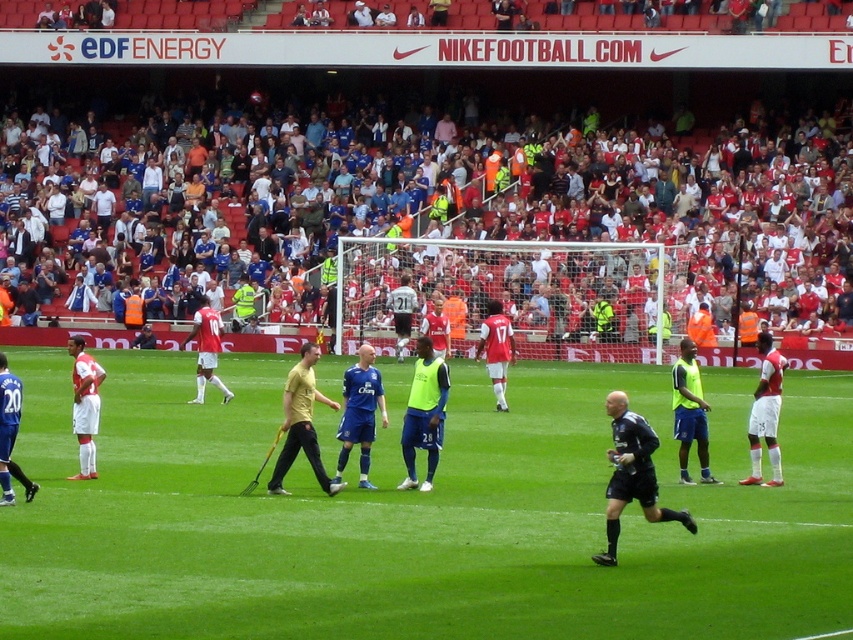
You are a photographer at the stadium trying to capture a photo of both the blue jersey at center and the white jersey at center. If you want to make sure both are in focus, which one should you adjust your camera focus to prioritize based on their sizes?

The blue jersey at center is smaller than the white jersey at center, so you should prioritize focusing on the blue jersey at center to ensure it is clear in the photo.

You are a drone operator trying to capture a closeup shot of both the blue jersey at center and the white jersey at center. What is the minimum distance you need to fly the drone to ensure both are in frame?

The minimum distance required is 25.30 feet, as that is the distance between the blue jersey at center and the white jersey at center.

You are a photographer positioned at the edge of the field. You need to capture a photo that includes both the green grass football field at center and the white matte shorts at right. Based on their positions, which object will appear larger in the photo?

The green grass football field at center appears larger in the photo because it is closer to the photographer than the white matte shorts at right, which are further away.